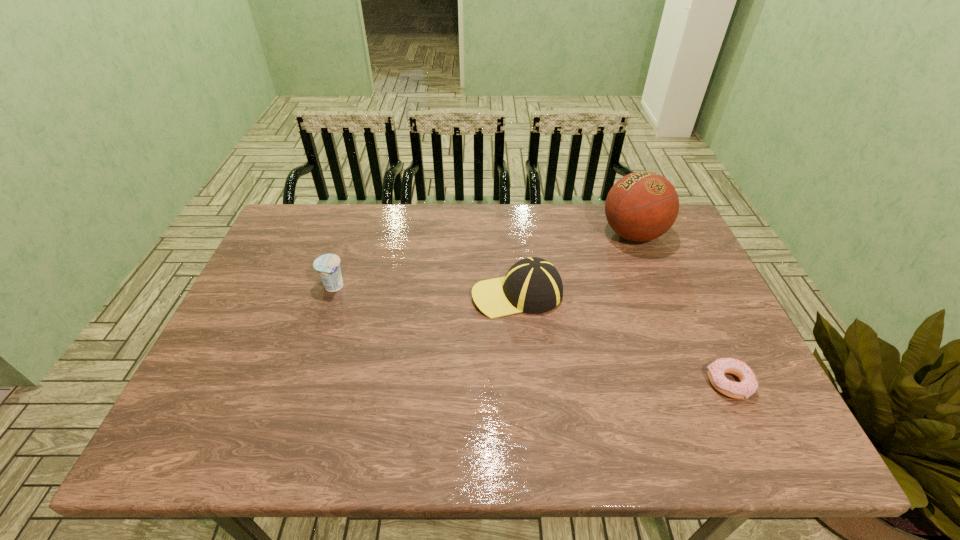
In the image, there is a desktop. Where is `vacant space at the left edge`? The height and width of the screenshot is (540, 960). vacant space at the left edge is located at coordinates (290, 256).

In the image, there is a desktop. Identify the location of vacant space at the right edge. Image resolution: width=960 pixels, height=540 pixels. (766, 413).

You are a GUI agent. You are given a task and a screenshot of the screen. Output one action in this format:
    pyautogui.click(x=<x>, y=<y>)
    Task: Click on the vacant space at the far left corner of the desktop
    This screenshot has height=540, width=960.
    Given the screenshot: What is the action you would take?
    pyautogui.click(x=285, y=232)

The width and height of the screenshot is (960, 540). In the image, there is a desktop. Identify the location of free space at the near left corner. (176, 426).

This screenshot has width=960, height=540. In the image, there is a desktop. Identify the location of vacant area at the far right corner. [x=641, y=245].

Image resolution: width=960 pixels, height=540 pixels. In order to click on free space between the farthest object and the third tallest object in this screenshot , I will do `click(484, 260)`.

I want to click on unoccupied area between the basketball and the shortest object, so click(x=682, y=309).

Identify the location of free space that is in between the farthest object and the leftmost object. Image resolution: width=960 pixels, height=540 pixels. (484, 260).

Locate an element on the screen. This screenshot has height=540, width=960. free space between the yogurt and the baseball cap is located at coordinates (425, 291).

Identify the location of vacant space that's between the leftmost object and the third shortest object. The width and height of the screenshot is (960, 540). (425, 291).